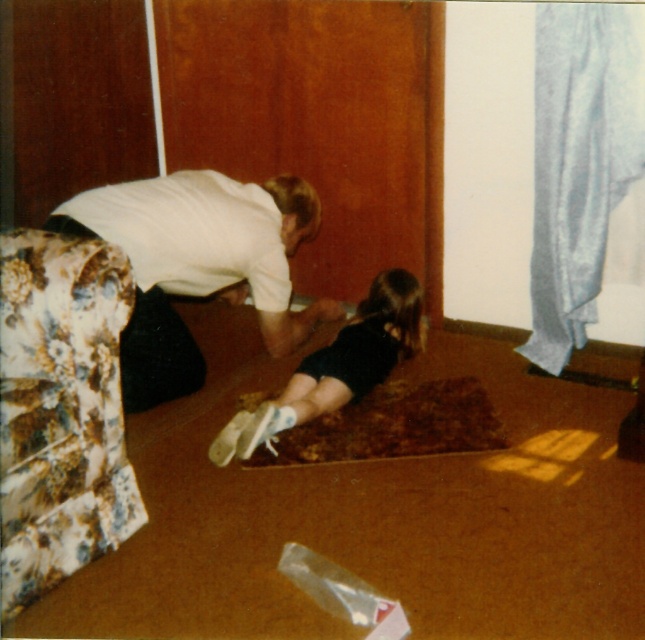
Is white matte shirt at center below black fabric dress at center?

No, white matte shirt at center is not below black fabric dress at center.

Identify the location of white matte shirt at center. This screenshot has width=645, height=640. (199, 266).

At what (x,y) coordinates should I click in order to perform the action: click on white matte shirt at center. Please return your answer as a coordinate pair (x, y). Looking at the image, I should click on (199, 266).